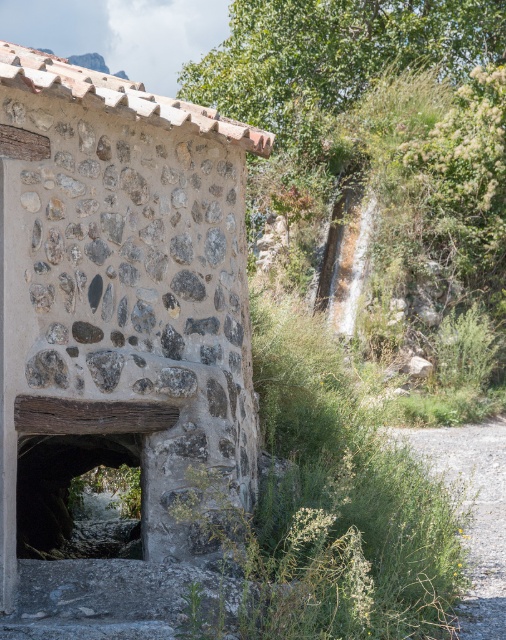
Between rustic stone hut at center and dark stone tunnel at center, which one appears on the left side from the viewer's perspective?

Positioned to the left is dark stone tunnel at center.

Can you confirm if rustic stone hut at center is taller than dark stone tunnel at center?

Yes, rustic stone hut at center is taller than dark stone tunnel at center.

Is point (104, 90) in front of point (26, 490)?

Yes, it is.

Where is `rustic stone hut at center`? This screenshot has height=640, width=506. rustic stone hut at center is located at coordinates (121, 291).